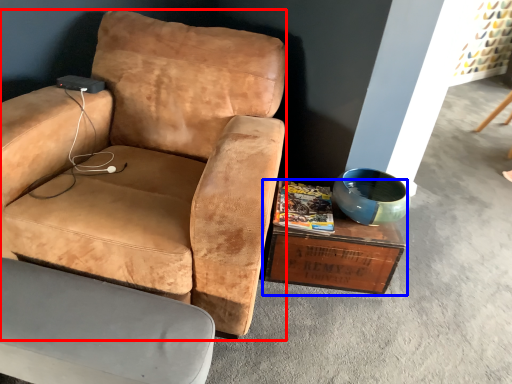
Question: Which object appears closest to the camera in this image, chair (highlighted by a red box) or coffee table (highlighted by a blue box)?

Choices:
 (A) chair
 (B) coffee table

Answer: (A)